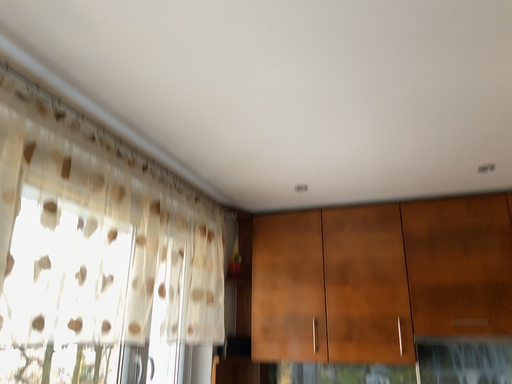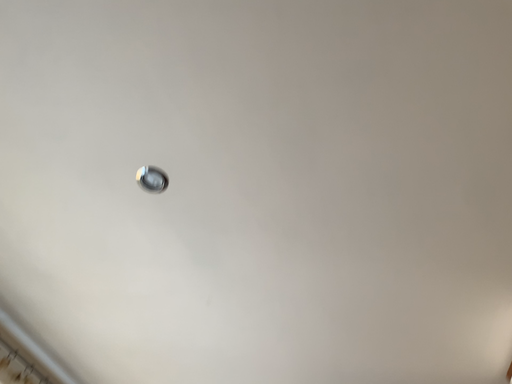
Question: Which way did the camera rotate in the video?

Choices:
 (A) rotated right
 (B) rotated left

Answer: (A)